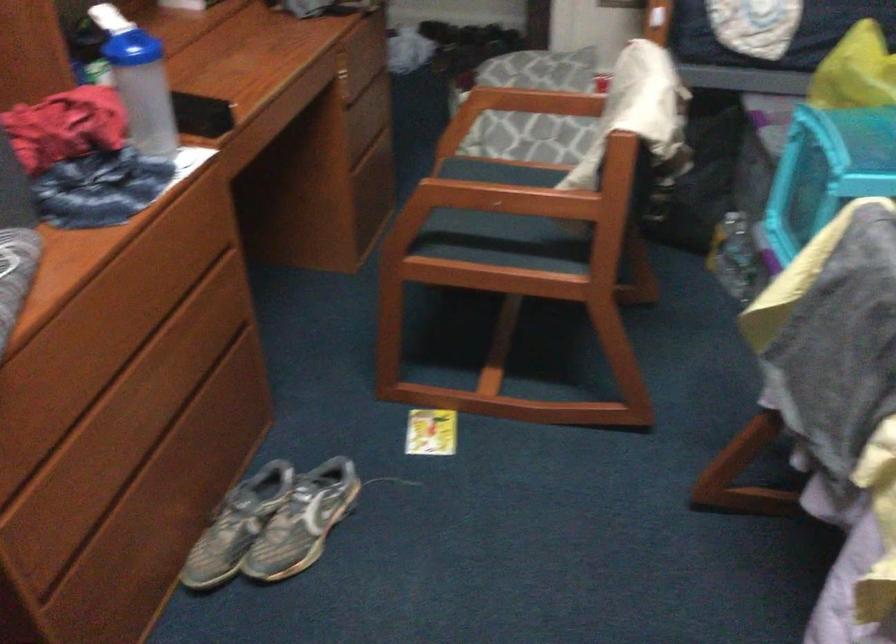
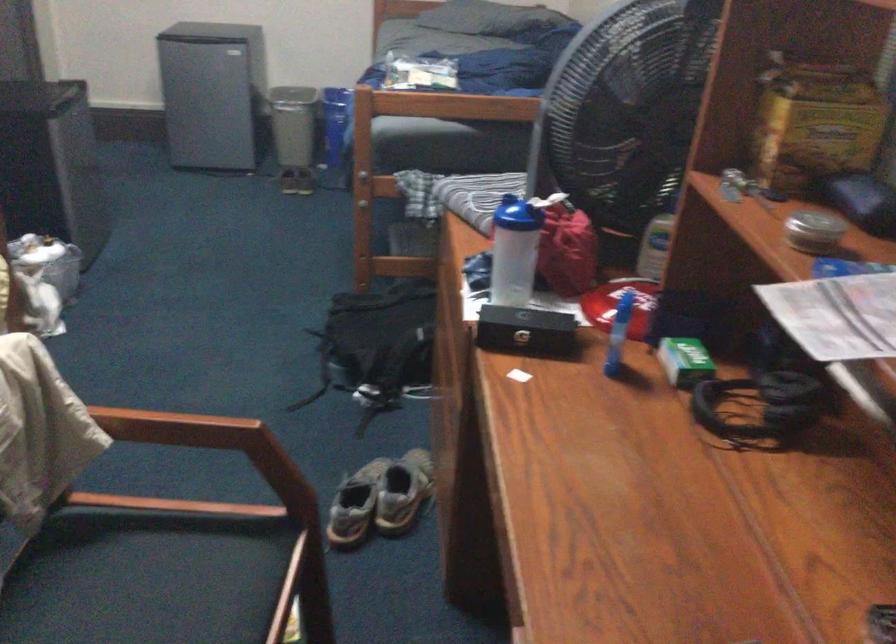
The point at (145,82) is marked in the first image. Where is the corresponding point in the second image?

(513, 251)